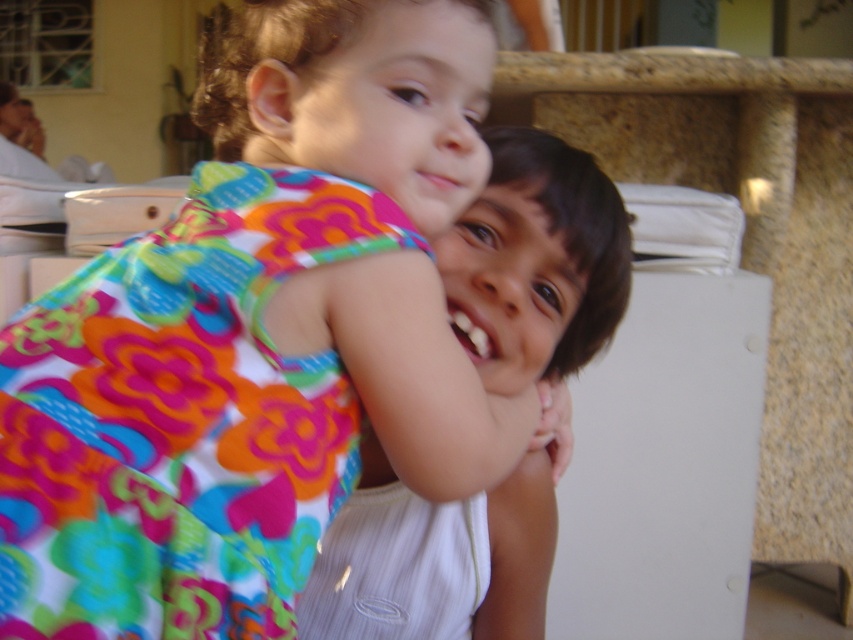
Between point (346, 205) and point (485, 605), which one is positioned in front?

Point (346, 205) is more forward.

Can you confirm if floral fabric dress at center is positioned below smooth white shirt at center?

No.

Between point (401, 196) and point (526, 336), which one is positioned behind?

Positioned behind is point (526, 336).

The width and height of the screenshot is (853, 640). In order to click on floral fabric dress at center in this screenshot , I will do `click(257, 337)`.